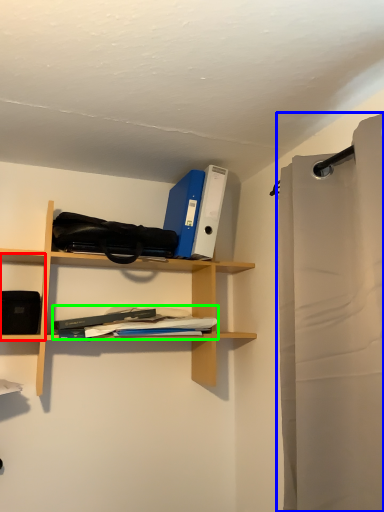
Question: Estimate the real-world distances between objects in this image. Which object is closer to cabinet (highlighted by a red box), shower curtain (highlighted by a blue box) or book (highlighted by a green box)?

Choices:
 (A) shower curtain
 (B) book

Answer: (B)